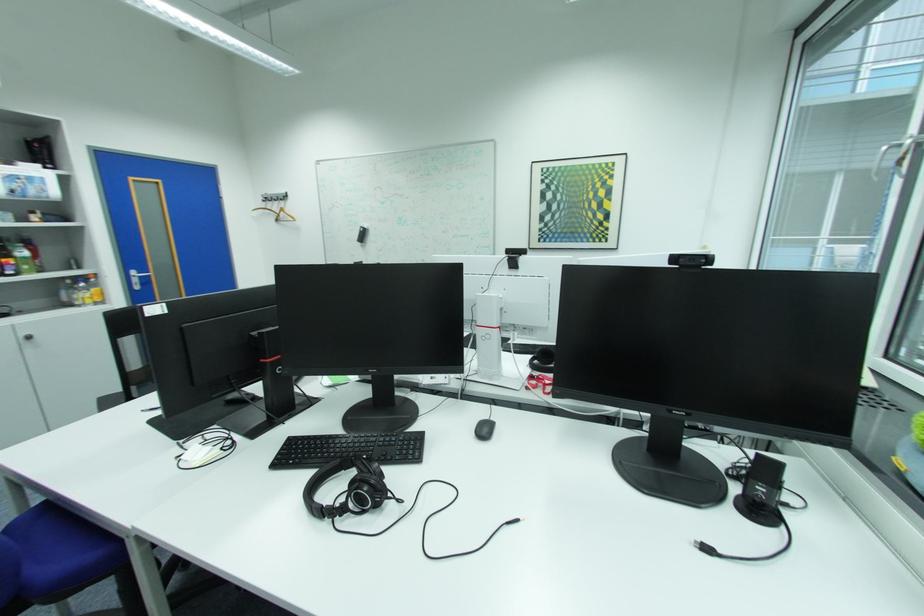
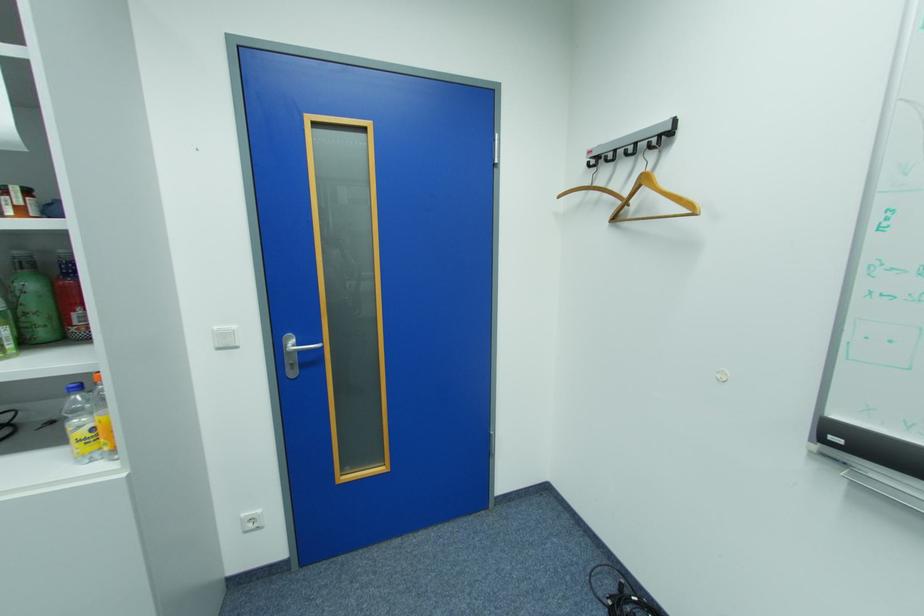
In the second image, find the point that corresponds to the point at 285,221 in the first image.

(624, 220)